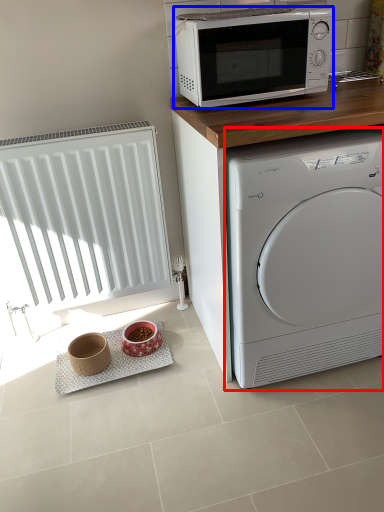
Question: Which object appears farthest to the camera in this image, washing machine (highlighted by a red box) or microwave oven (highlighted by a blue box)?

Choices:
 (A) washing machine
 (B) microwave oven

Answer: (B)